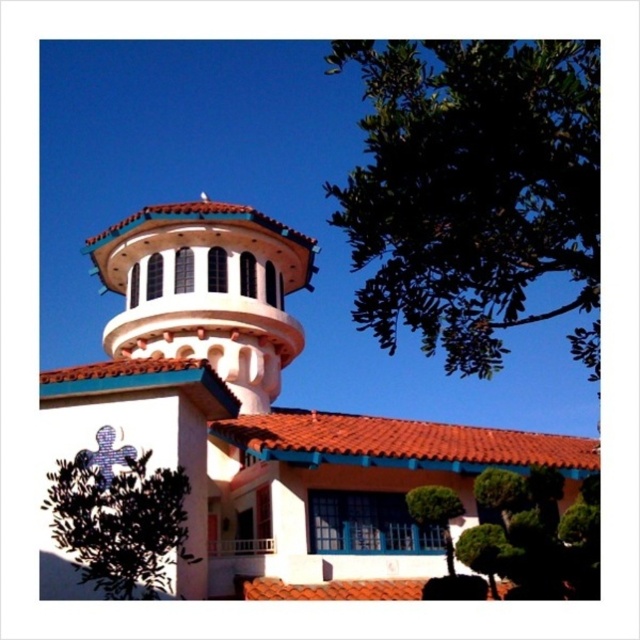
Question: Estimate the real-world distances between objects in this image. Which object is closer to the green leafy tree at lower left?

Choices:
 (A) terracotta tile roof at center
 (B) green leafy tree at upper right
 (C) green leafy tree at lower center

Answer: (C)

Question: Is green leafy tree at lower left below green leafy tree at lower center?

Choices:
 (A) no
 (B) yes

Answer: (B)

Question: Does green leafy bush at lower right appear on the right side of green leafy tree at lower center?

Choices:
 (A) no
 (B) yes

Answer: (B)

Question: Which point is closer to the camera?

Choices:
 (A) green leafy tree at lower left
 (B) green leafy bush at lower right
 (C) white stucco bell tower at upper center

Answer: (A)

Question: Which point is closer to the camera?

Choices:
 (A) pos(506,573)
 (B) pos(84,499)

Answer: (B)

Question: Does green leafy tree at lower left have a lesser width compared to terracotta tile roof at center?

Choices:
 (A) yes
 (B) no

Answer: (A)